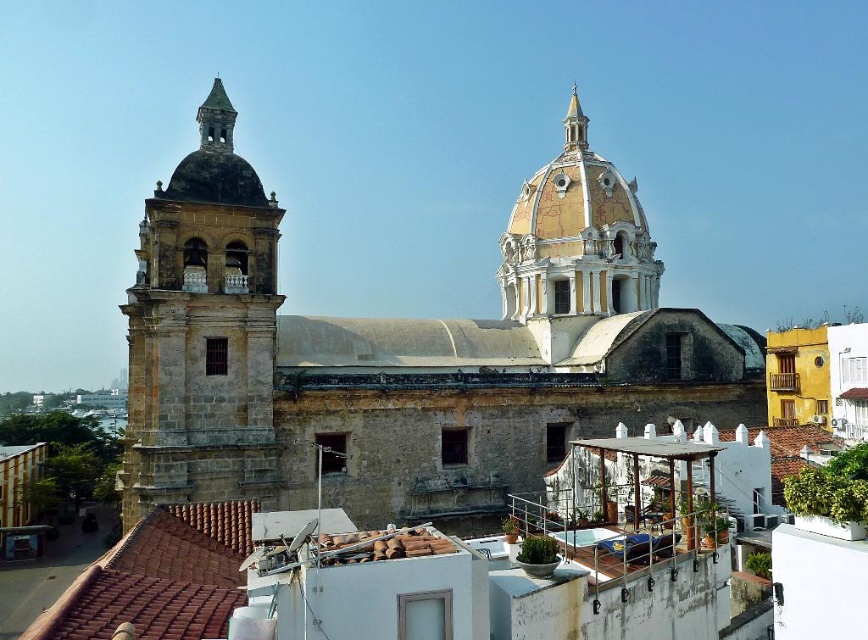
Is point (590, 317) farther from camera compared to point (645, 244)?

No, (590, 317) is closer to viewer.

Does brown stone church at center appear over yellowish marble dome at upper center?

No.

Is point (490, 451) behind point (587, 161)?

That is False.

The image size is (868, 640). I want to click on brown stone church at center, so click(402, 355).

Which is above, brown stone bell tower at left or gold textured spire at upper center?

gold textured spire at upper center is above.

Is brown stone bell tower at left to the left of gold textured spire at upper center from the viewer's perspective?

Correct, you'll find brown stone bell tower at left to the left of gold textured spire at upper center.

Identify the location of brown stone bell tower at left. The image size is (868, 640). (202, 330).

The width and height of the screenshot is (868, 640). I want to click on brown stone bell tower at left, so click(x=202, y=330).

Is brown stone church at center in front of brown stone bell tower at left?

No.

Who is lower down, brown stone church at center or brown stone bell tower at left?

brown stone church at center is below.

What do you see at coordinates (402, 355) in the screenshot?
I see `brown stone church at center` at bounding box center [402, 355].

Image resolution: width=868 pixels, height=640 pixels. I want to click on brown stone church at center, so click(x=402, y=355).